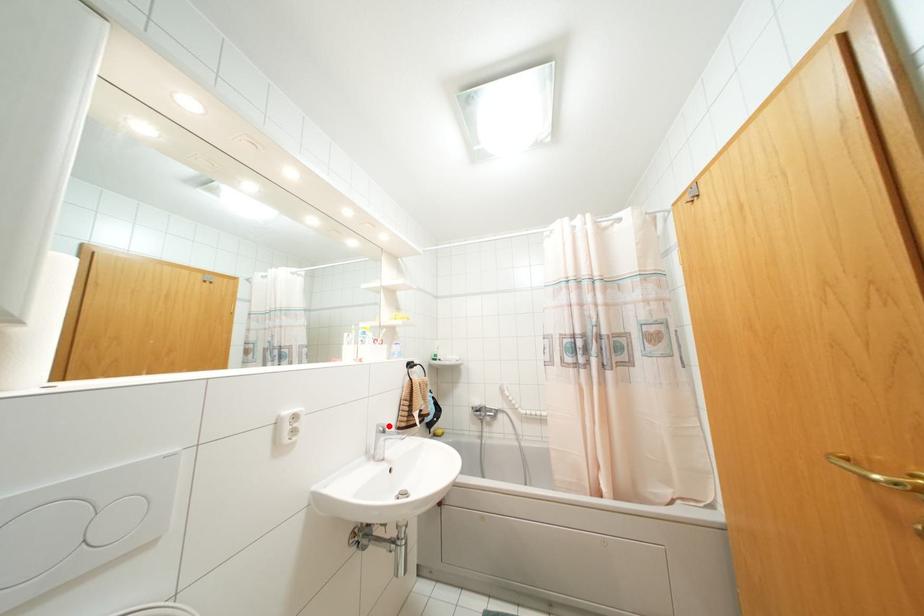
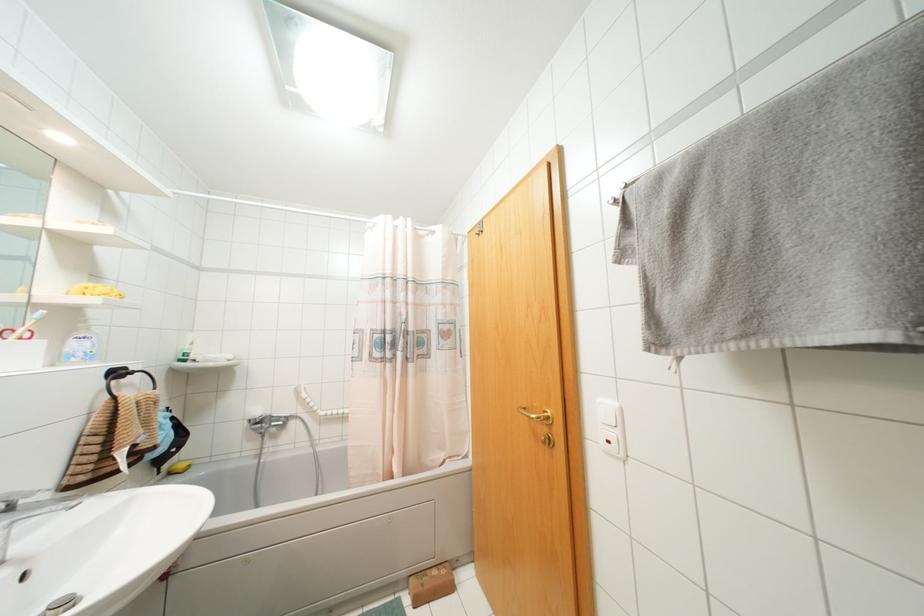
Question: I am providing you with two images of the same scene from different viewpoints. Given a red point in image1, look at the same physical point in image2. Is it:

Choices:
 (A) Closer to the viewpoint
 (B) Farther from the viewpoint

Answer: (A)